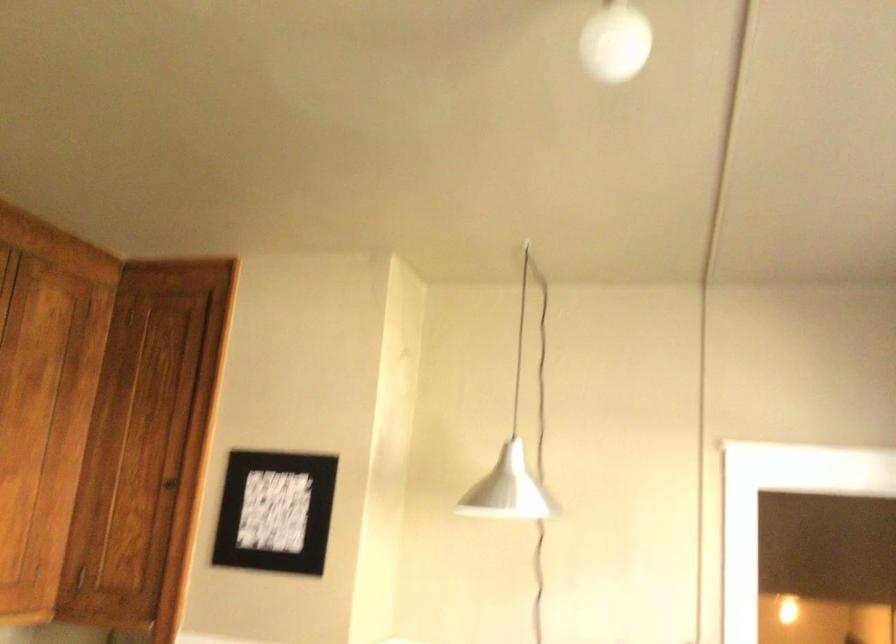
Where would you lift the black picture frame? Please return your answer as a coordinate pair (x, y).

(274, 512)